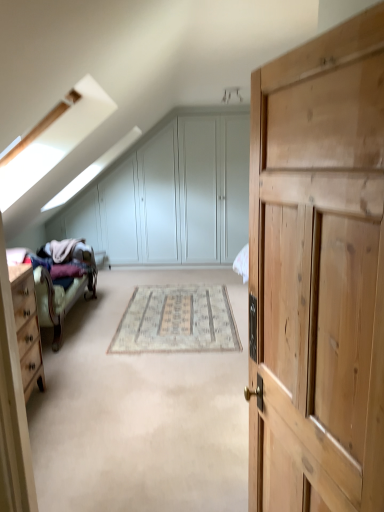
Question: From the image's perspective, is light wood dresser at left under beige woven rug at center?

Choices:
 (A) yes
 (B) no

Answer: (A)

Question: Is light wood dresser at left positioned before beige woven rug at center?

Choices:
 (A) yes
 (B) no

Answer: (A)

Question: Is light wood dresser at left thinner than beige woven rug at center?

Choices:
 (A) no
 (B) yes

Answer: (B)

Question: Is light wood dresser at left positioned with its back to beige woven rug at center?

Choices:
 (A) yes
 (B) no

Answer: (B)

Question: Is light wood dresser at left wider than beige woven rug at center?

Choices:
 (A) yes
 (B) no

Answer: (B)

Question: Is the depth of light wood dresser at left greater than that of beige woven rug at center?

Choices:
 (A) yes
 (B) no

Answer: (B)

Question: Is beige woven rug at center thinner than natural wood cupboard at right?

Choices:
 (A) yes
 (B) no

Answer: (B)

Question: Does beige woven rug at center lie behind natural wood cupboard at right?

Choices:
 (A) yes
 (B) no

Answer: (A)

Question: Does beige woven rug at center appear on the left side of natural wood cupboard at right?

Choices:
 (A) no
 (B) yes

Answer: (B)

Question: Does beige woven rug at center have a lesser height compared to natural wood cupboard at right?

Choices:
 (A) yes
 (B) no

Answer: (A)

Question: From a real-world perspective, is beige woven rug at center beneath natural wood cupboard at right?

Choices:
 (A) no
 (B) yes

Answer: (B)

Question: From the image's perspective, would you say beige woven rug at center is shown under natural wood cupboard at right?

Choices:
 (A) no
 (B) yes

Answer: (B)

Question: Does wooden bed frame at left have a larger size compared to natural wood cupboard at right?

Choices:
 (A) no
 (B) yes

Answer: (B)